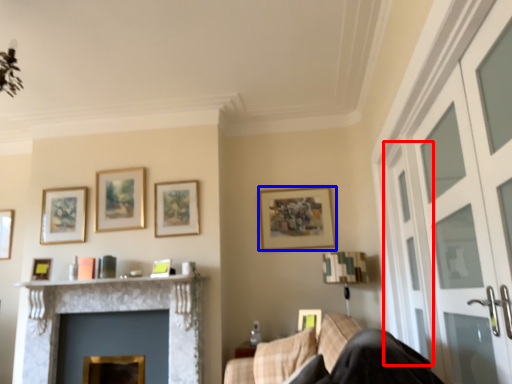
Question: Which of the following is the closest to the observer, screen door (highlighted by a red box) or picture frame (highlighted by a blue box)?

Choices:
 (A) screen door
 (B) picture frame

Answer: (A)